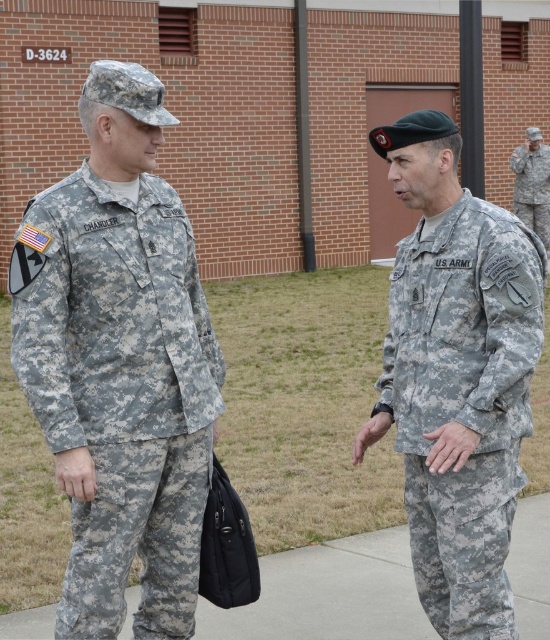
You are a photographer trying to capture a photo of both the camouflage fabric uniform at left and the camouflage fabric uniform at center. Since you want to ensure both are in focus, you need to know which one is higher up. Can you tell me which one is positioned higher?

The camouflage fabric uniform at left is located above camouflage fabric uniform at center, so the camouflage fabric uniform at left is higher up.